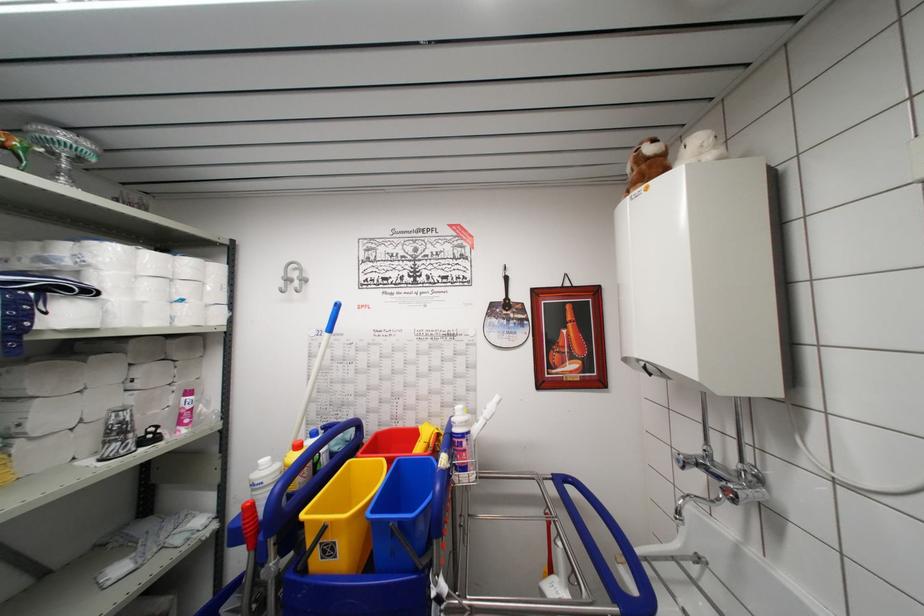
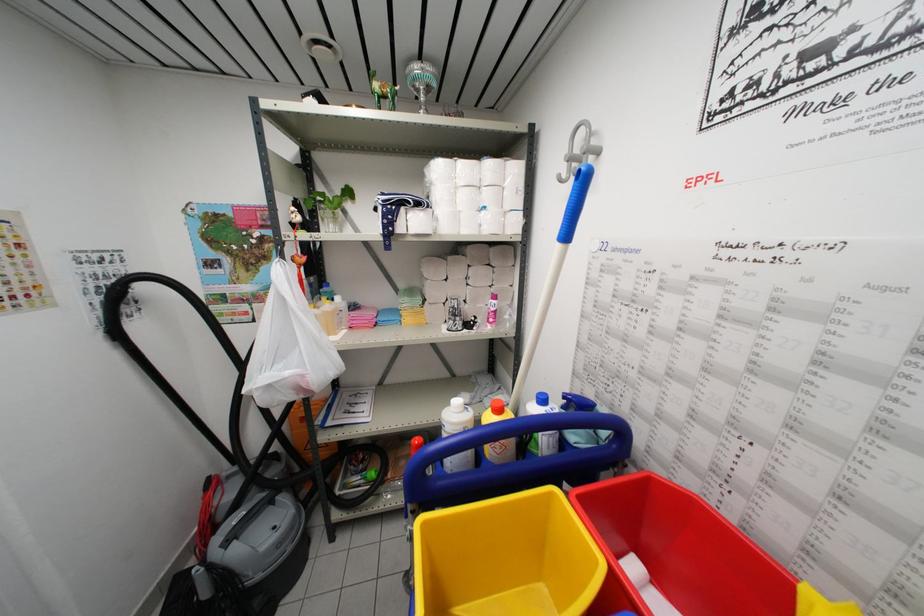
In the second image, find the point that corresponds to [96,362] in the first image.

(453, 262)